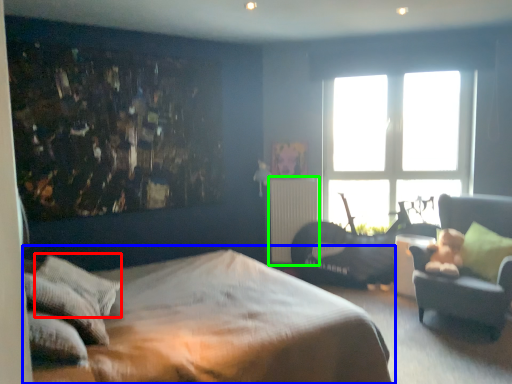
Question: Considering the real-world distances, which object is farthest from pillow (highlighted by a red box)? bed (highlighted by a blue box) or radiator (highlighted by a green box)?

Choices:
 (A) bed
 (B) radiator

Answer: (B)